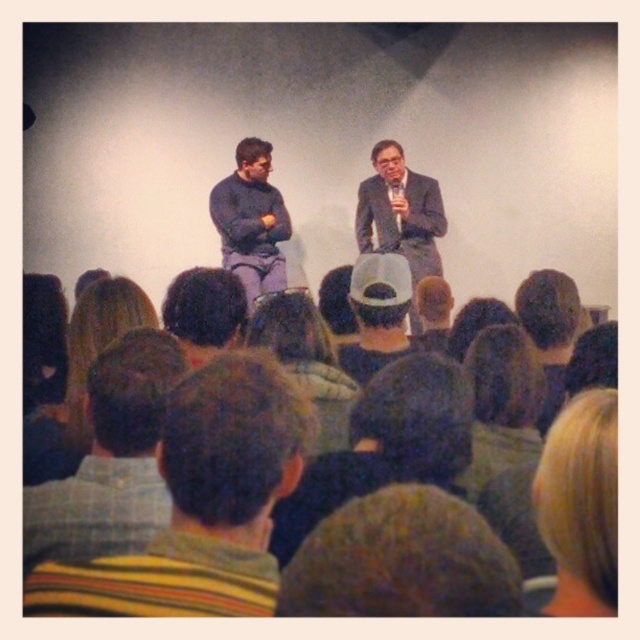
Is point (122, 520) farther from viewer compared to point (268, 188)?

No, it is in front of (268, 188).

Who is more distant from viewer, (51, 524) or (244, 257)?

Positioned behind is point (244, 257).

The height and width of the screenshot is (640, 640). What do you see at coordinates (109, 458) in the screenshot?
I see `striped shirt at lower left` at bounding box center [109, 458].

The width and height of the screenshot is (640, 640). I want to click on striped shirt at lower left, so click(x=109, y=458).

What do you see at coordinates (202, 502) in the screenshot?
I see `striped sweater at center` at bounding box center [202, 502].

Does point (204, 483) lie in front of point (280, 196)?

Yes, it is.

The image size is (640, 640). What are the coordinates of `striped sweater at center` in the screenshot? It's located at (202, 502).

Who is more forward, (262, 385) or (419, 257)?

Point (262, 385)

Measure the distance between point [86,589] and camera.

31.98 inches

Find the location of a particular element. This screenshot has width=640, height=640. striped sweater at center is located at coordinates (202, 502).